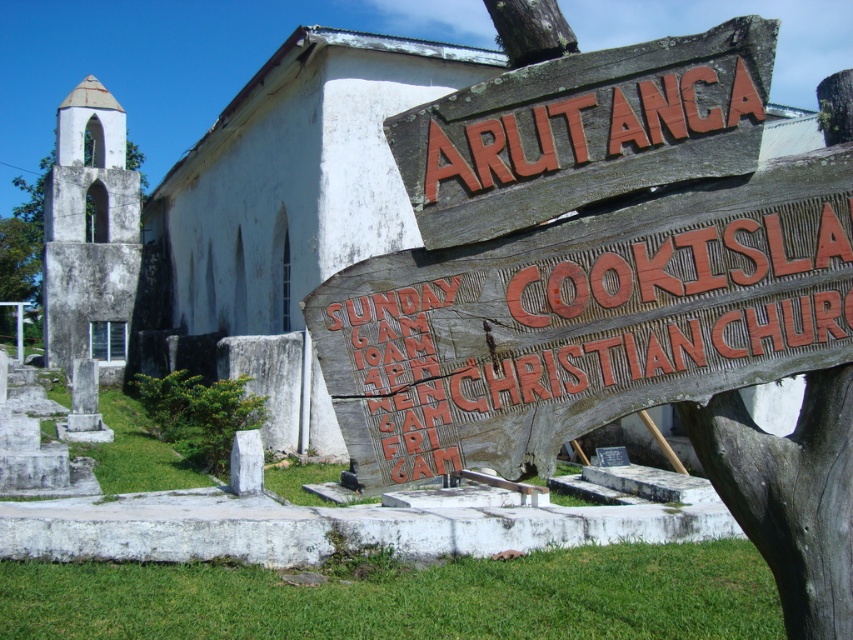
Question: Observing the image, what is the correct spatial positioning of weathered wood sign at center in reference to white stone chapel at left?

Choices:
 (A) right
 (B) left

Answer: (A)

Question: Which object is closer to the camera taking this photo?

Choices:
 (A) wooden sign at upper center
 (B) white stone chapel at left

Answer: (A)

Question: Considering the relative positions of weathered wood sign at center and wooden sign at upper center in the image provided, where is weathered wood sign at center located with respect to wooden sign at upper center?

Choices:
 (A) left
 (B) right

Answer: (B)

Question: Is wooden sign at upper center to the right of white stone chapel at left from the viewer's perspective?

Choices:
 (A) no
 (B) yes

Answer: (B)

Question: Estimate the real-world distances between objects in this image. Which object is farther from the white stone chapel at left?

Choices:
 (A) weathered wood sign at center
 (B) wooden sign at upper center

Answer: (B)

Question: Which of the following is the farthest from the observer?

Choices:
 (A) (55, 316)
 (B) (660, 58)
 (C) (552, 400)

Answer: (A)